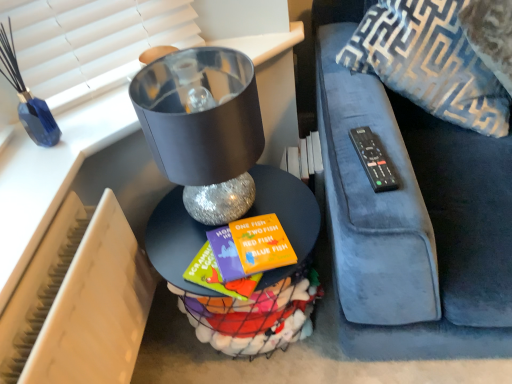
Question: From a real-world perspective, is blue textured throw pillow at upper right positioned under black plastic remote at right based on gravity?

Choices:
 (A) no
 (B) yes

Answer: (A)

Question: From a real-world perspective, is blue textured throw pillow at upper right located higher than black plastic remote at right?

Choices:
 (A) no
 (B) yes

Answer: (B)

Question: Considering the relative sizes of blue textured throw pillow at upper right and black plastic remote at right in the image provided, is blue textured throw pillow at upper right bigger than black plastic remote at right?

Choices:
 (A) no
 (B) yes

Answer: (B)

Question: Can you confirm if blue textured throw pillow at upper right is thinner than black plastic remote at right?

Choices:
 (A) yes
 (B) no

Answer: (B)

Question: Does blue textured throw pillow at upper right have a greater height compared to black plastic remote at right?

Choices:
 (A) yes
 (B) no

Answer: (A)

Question: Would you consider blue textured throw pillow at upper right to be distant from black plastic remote at right?

Choices:
 (A) yes
 (B) no

Answer: (B)

Question: From the image's perspective, is black plastic remote at right on top of beige plastic radiator at lower left?

Choices:
 (A) no
 (B) yes

Answer: (B)

Question: Is black plastic remote at right next to beige plastic radiator at lower left?

Choices:
 (A) yes
 (B) no

Answer: (B)

Question: Considering the relative positions of black plastic remote at right and beige plastic radiator at lower left in the image provided, is black plastic remote at right to the right of beige plastic radiator at lower left from the viewer's perspective?

Choices:
 (A) yes
 (B) no

Answer: (A)

Question: Could beige plastic radiator at lower left be considered to be inside black plastic remote at right?

Choices:
 (A) no
 (B) yes

Answer: (A)

Question: Does black plastic remote at right have a smaller size compared to beige plastic radiator at lower left?

Choices:
 (A) no
 (B) yes

Answer: (B)

Question: Is black plastic remote at right not close to beige plastic radiator at lower left?

Choices:
 (A) yes
 (B) no

Answer: (B)

Question: From the image's perspective, is metallic silver table at center located beneath black plastic remote at right?

Choices:
 (A) no
 (B) yes

Answer: (B)